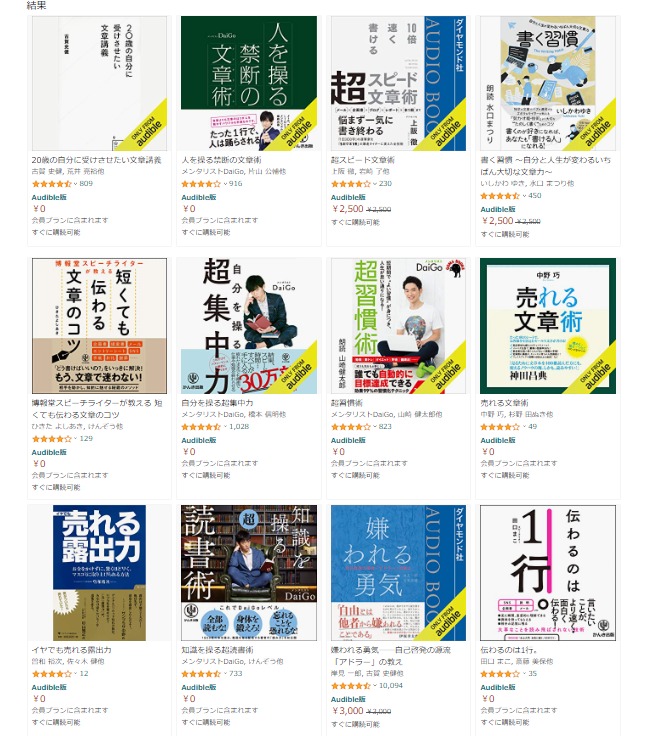
Where is `rack`? The width and height of the screenshot is (661, 736). rack is located at coordinates (223, 533).